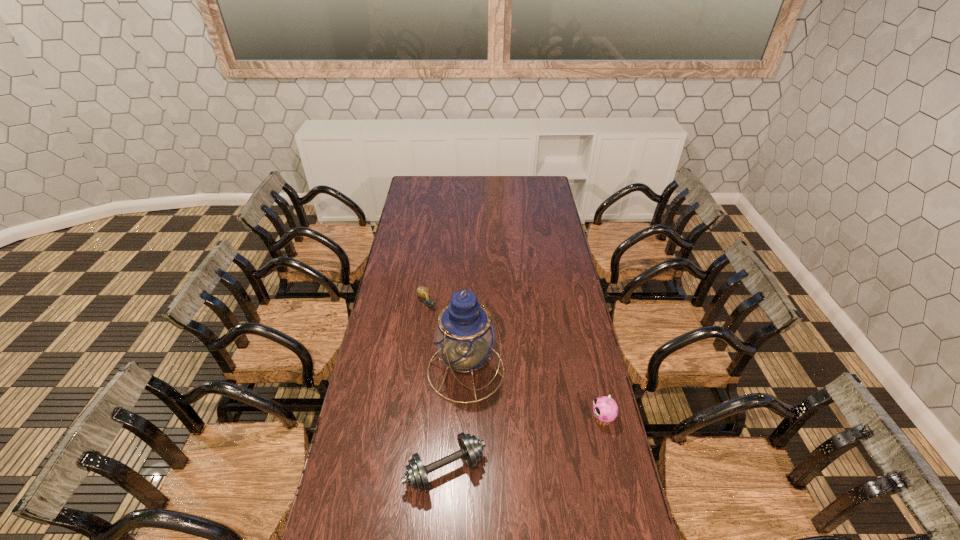
This screenshot has height=540, width=960. I want to click on free space on the desktop that is between the dumbbell and the third shortest object and is positioned on the front-facing side of the farthest object, so click(x=540, y=439).

The width and height of the screenshot is (960, 540). Identify the location of free space on the desktop that is between the third tallest object and the rightmost object and is positioned on the front-facing side of the second farthest object. (548, 436).